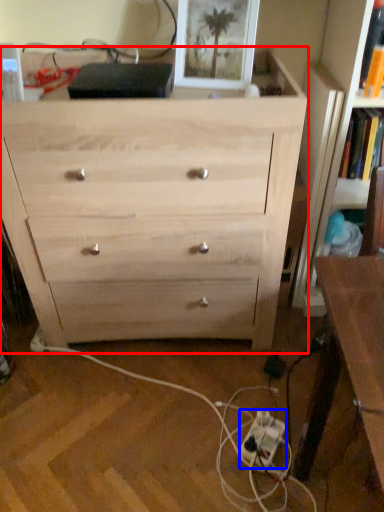
Question: Among these objects, which one is nearest to the camera, chest of drawers (highlighted by a red box) or extension cord (highlighted by a blue box)?

Choices:
 (A) chest of drawers
 (B) extension cord

Answer: (A)